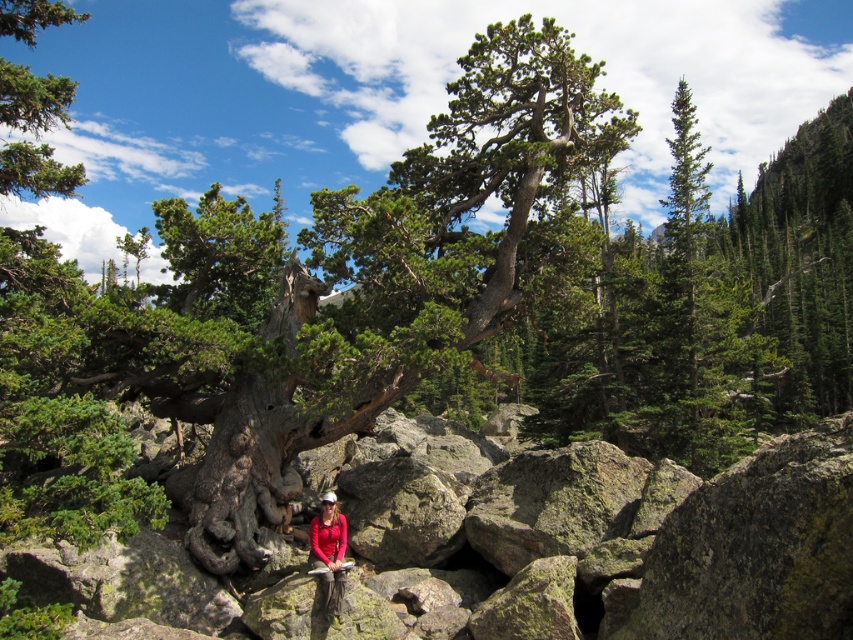
Between green mossy rock at center and gray rough boulder at center, which one has less height?

gray rough boulder at center

Is green mossy rock at center bigger than gray rough boulder at center?

Yes.

Is point (314, 637) farther from viewer compared to point (439, 509)?

No, it is in front of (439, 509).

The height and width of the screenshot is (640, 853). What are the coordinates of `green mossy rock at center` in the screenshot? It's located at (527, 552).

Is point (556, 598) more distant than point (309, 532)?

That is False.

What do you see at coordinates (527, 552) in the screenshot? I see `green mossy rock at center` at bounding box center [527, 552].

Does point (796, 628) lie behind point (340, 586)?

No, it is in front of (340, 586).

I want to click on green mossy rock at center, so click(527, 552).

Is point (409, 556) positioned after point (334, 609)?

That is True.

Who is more distant from viewer, [361,502] or [326,582]?

The point [361,502] is behind.

The width and height of the screenshot is (853, 640). What are the coordinates of `gray rough boulder at center` in the screenshot? It's located at (402, 512).